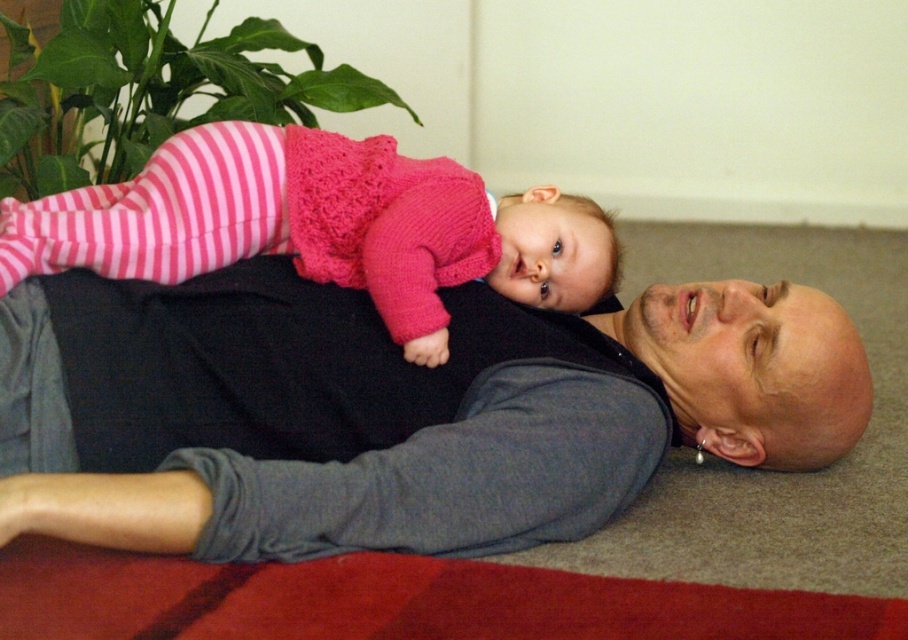
Question: Can you confirm if gray soft shirt at center is positioned below pink knitted sweater at upper center?

Choices:
 (A) no
 (B) yes

Answer: (B)

Question: Does gray soft shirt at center appear on the right side of pink knitted sweater at upper center?

Choices:
 (A) no
 (B) yes

Answer: (B)

Question: Which object appears farthest from the camera in this image?

Choices:
 (A) gray soft shirt at center
 (B) pink knitted sweater at upper center

Answer: (B)

Question: Can you confirm if gray soft shirt at center is positioned to the right of pink knitted sweater at upper center?

Choices:
 (A) no
 (B) yes

Answer: (B)